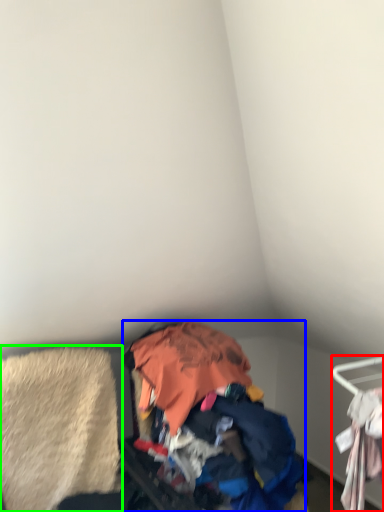
Question: Which object is positioned closest to furniture (highlighted by a red box)? Select from garbage (highlighted by a blue box) and clothing (highlighted by a green box).

Choices:
 (A) garbage
 (B) clothing

Answer: (A)